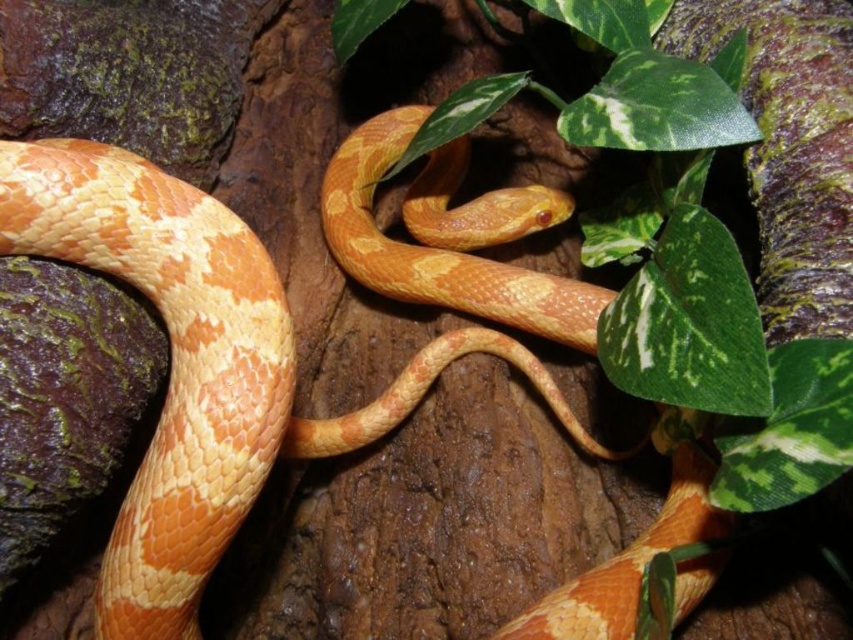
Question: Among these objects, which one is farthest from the camera?

Choices:
 (A) green leafy plant at upper center
 (B) orange scaly snake at center

Answer: (B)

Question: Is orange scaly snake at center smaller than green leafy plant at upper center?

Choices:
 (A) yes
 (B) no

Answer: (B)

Question: Is orange scaly snake at center positioned behind green leafy plant at upper center?

Choices:
 (A) yes
 (B) no

Answer: (A)

Question: Which point is closer to the camera taking this photo?

Choices:
 (A) (432, 276)
 (B) (544, 314)

Answer: (B)

Question: From the image, what is the correct spatial relationship of orange scaly snake at center in relation to green leafy plant at upper center?

Choices:
 (A) above
 (B) below

Answer: (B)

Question: Which object is farther from the camera taking this photo?

Choices:
 (A) orange scaly snake at center
 (B) green leafy plant at upper center

Answer: (A)